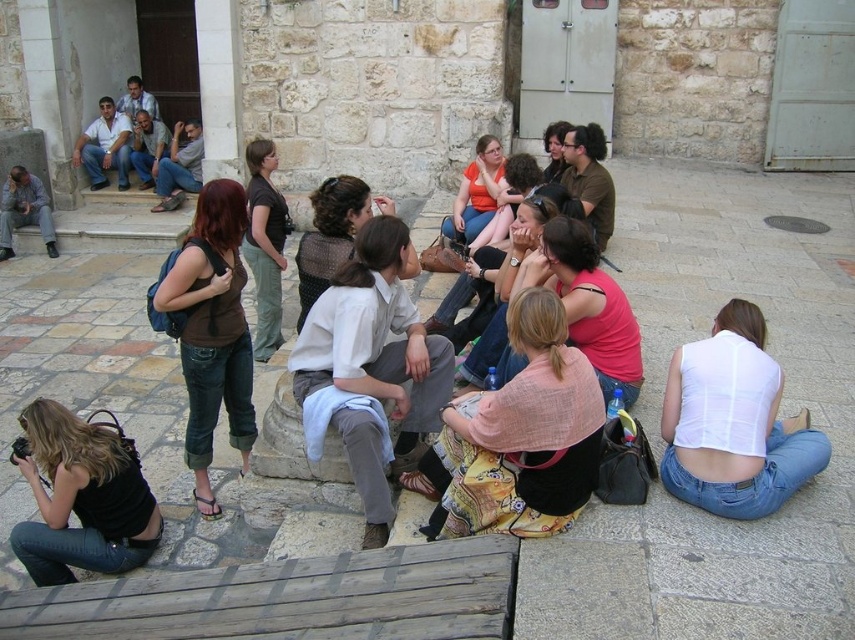
Is white sheer top at lower right wider than black denim jeans at lower left?

Yes, white sheer top at lower right is wider than black denim jeans at lower left.

Is white sheer top at lower right positioned behind black denim jeans at lower left?

That is False.

At what (x,y) coordinates should I click in order to perform the action: click on white sheer top at lower right. Please return your answer as a coordinate pair (x, y). The width and height of the screenshot is (855, 640). Looking at the image, I should click on (x=733, y=422).

Is light brown fabric shirt at center behind matte black shirt at center?

No, light brown fabric shirt at center is in front of matte black shirt at center.

The width and height of the screenshot is (855, 640). Describe the element at coordinates (374, 336) in the screenshot. I see `light brown fabric shirt at center` at that location.

The width and height of the screenshot is (855, 640). What are the coordinates of `light brown fabric shirt at center` in the screenshot? It's located at (374, 336).

Is white sheer top at lower right smaller than knitted sweater at center?

No, white sheer top at lower right is not smaller than knitted sweater at center.

Measure the distance between white sheer top at lower right and knitted sweater at center.

white sheer top at lower right is 3.70 meters away from knitted sweater at center.

Between point (709, 481) and point (304, 301), which one is positioned in front?

Point (709, 481) is more forward.

What are the coordinates of `white sheer top at lower right` in the screenshot? It's located at (733, 422).